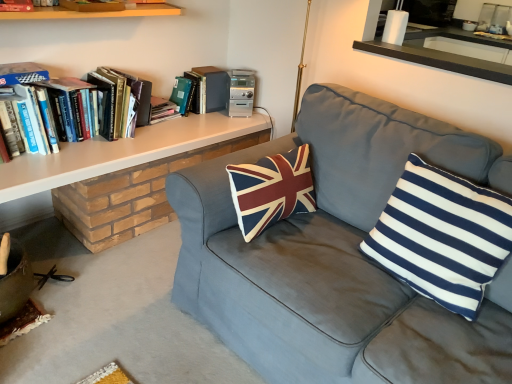
This screenshot has height=384, width=512. Identify the location of vacant area that is in front of hardcover book at upper left, which ranks as the second book in back-to-front order. (155, 131).